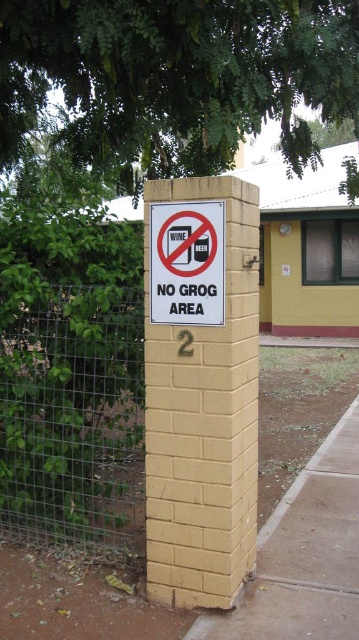
You are standing in a park and see a green leafy tree at upper center and a wire mesh fence at left. Which object is taller?

The green leafy tree at upper center is taller than the wire mesh fence at left.

You are standing in front of the rectangular brick column and looking at the green leafy tree at upper center and the white paper sign at center. Which object is closer to you?

The green leafy tree at upper center is closer to you because it is further to the viewer than the white paper sign at center.

You are standing in a park and see the yellow brick post at center and the wire mesh fence at left. Which object is closer to you?

The yellow brick post at center is closer to you because it is in front of the wire mesh fence at left.